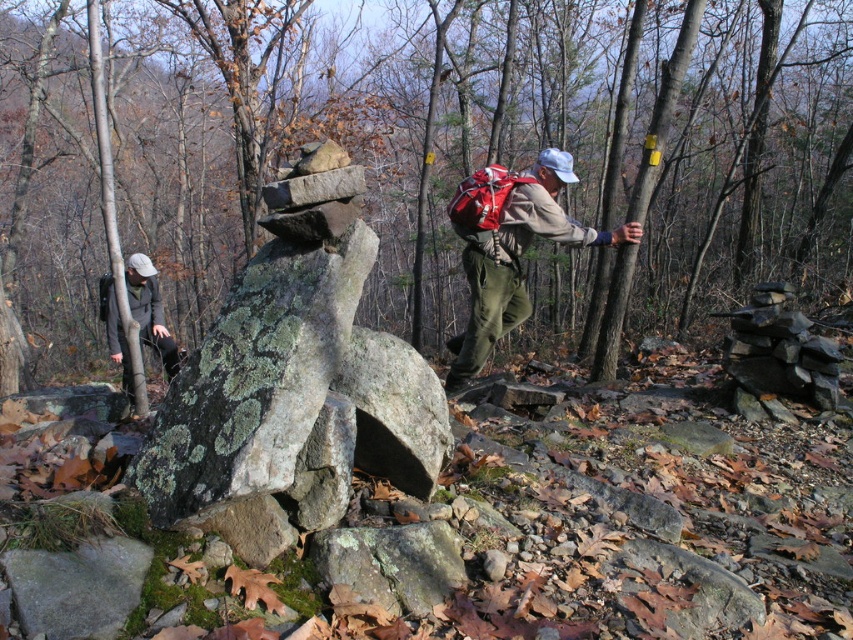
Is the position of matte red backpack at center less distant than that of khaki fabric jacket at left?

No, it is not.

Between point (469, 204) and point (149, 260), which one is positioned behind?

Positioned behind is point (149, 260).

This screenshot has height=640, width=853. Identify the location of matte red backpack at center. (509, 248).

From the picture: Can you confirm if lichen-covered rock at center is smaller than khaki fabric jacket at left?

Indeed, lichen-covered rock at center has a smaller size compared to khaki fabric jacket at left.

Can you confirm if lichen-covered rock at center is taller than khaki fabric jacket at left?

Correct, lichen-covered rock at center is much taller as khaki fabric jacket at left.

Identify the location of lichen-covered rock at center. (289, 364).

Can you confirm if lichen-covered rock at center is smaller than matte red backpack at center?

Yes, lichen-covered rock at center is smaller than matte red backpack at center.

Does lichen-covered rock at center come in front of matte red backpack at center?

Yes, lichen-covered rock at center is closer to the viewer.

This screenshot has width=853, height=640. What do you see at coordinates (289, 364) in the screenshot?
I see `lichen-covered rock at center` at bounding box center [289, 364].

You are a GUI agent. You are given a task and a screenshot of the screen. Output one action in this format:
    pyautogui.click(x=<x>, y=<y>)
    Task: Click on the lichen-covered rock at center
    This screenshot has width=853, height=640.
    Given the screenshot: What is the action you would take?
    pyautogui.click(x=289, y=364)